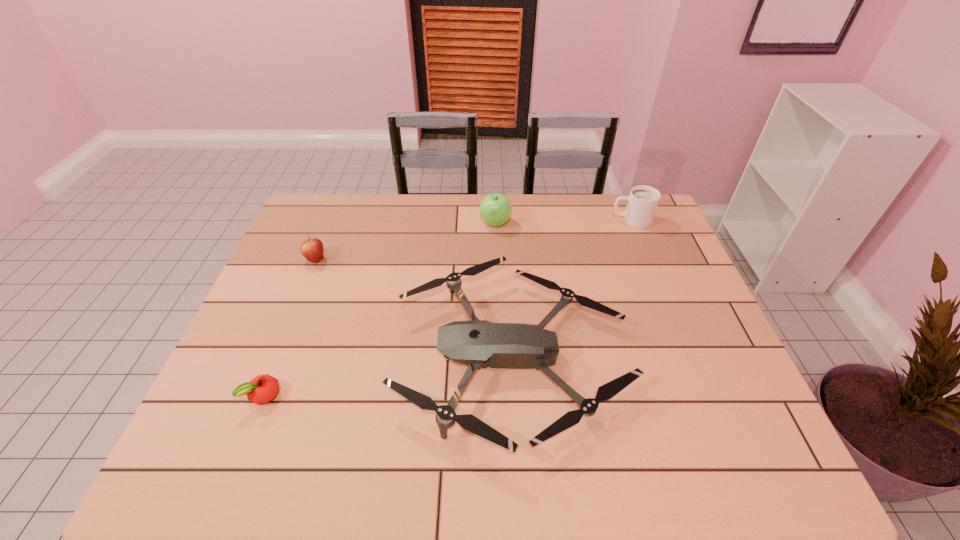
Find the location of `vacant region located 0.050m on the back of the second nearest apple`. vacant region located 0.050m on the back of the second nearest apple is located at coordinates (323, 242).

At what (x,y) coordinates should I click in order to perform the action: click on vacant region located with a camera mounted on the front of the drone. Please return your answer as a coordinate pair (x, y). Image resolution: width=960 pixels, height=540 pixels. Looking at the image, I should click on (339, 356).

You are a GUI agent. You are given a task and a screenshot of the screen. Output one action in this format:
    pyautogui.click(x=<x>, y=<y>)
    Task: Click on the free space located 0.200m with a camera mounted on the front of the drone
    
    Given the screenshot: What is the action you would take?
    pyautogui.click(x=315, y=356)

Identify the location of free space located 0.120m with a camera mounted on the front of the drone. Image resolution: width=960 pixels, height=540 pixels. (347, 356).

Find the location of a particular element. Image resolution: width=960 pixels, height=540 pixels. free location located 0.380m on the right of the nearest apple is located at coordinates (x=445, y=395).

The image size is (960, 540). I want to click on apple at the far edge, so pos(495,210).

Identify the location of cappuccino present at the far edge. This screenshot has width=960, height=540. (643, 200).

This screenshot has width=960, height=540. Find the location of `object situated at the near edge`. object situated at the near edge is located at coordinates (478, 342).

This screenshot has height=540, width=960. What are the coordinates of `object that is at the right edge` in the screenshot? It's located at (643, 200).

Locate an element on the screen. This screenshot has width=960, height=540. object situated at the far right corner is located at coordinates (643, 200).